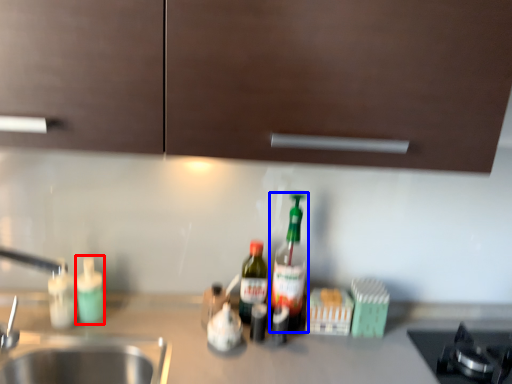
Question: Which of the following is the closest to the observer, bottle (highlighted by a red box) or bottle (highlighted by a blue box)?

Choices:
 (A) bottle
 (B) bottle

Answer: (B)